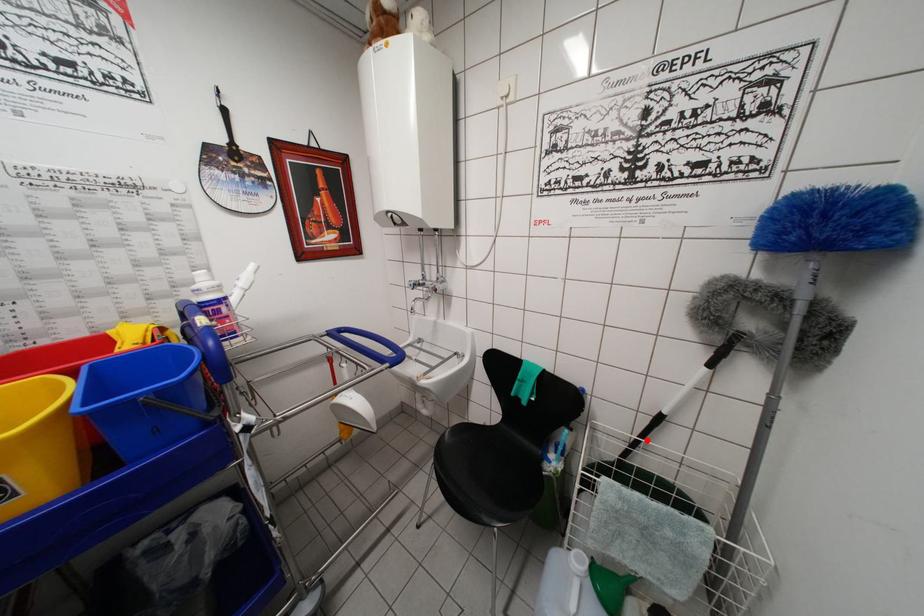
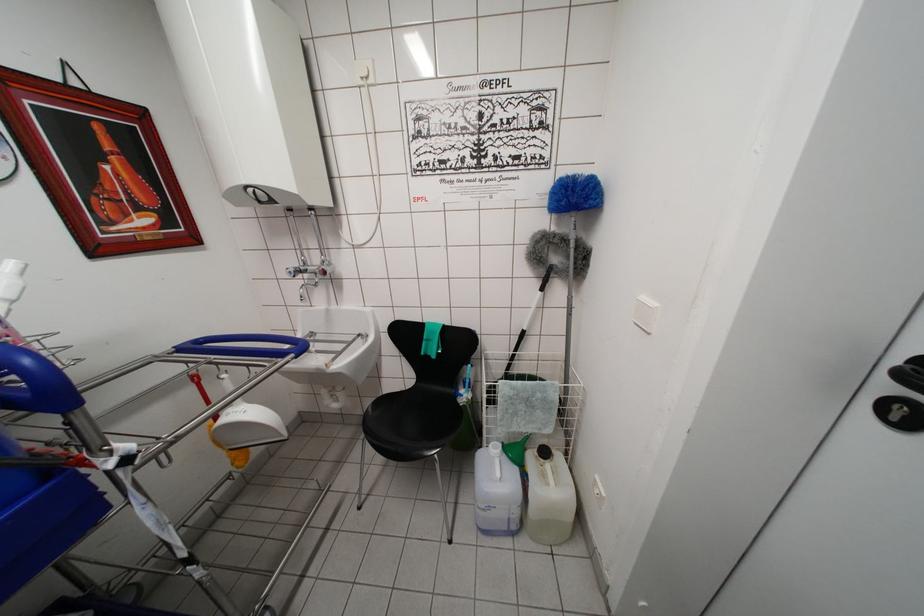
Find the pixel in the second image that matches the highlighted location in the first image.

(518, 354)